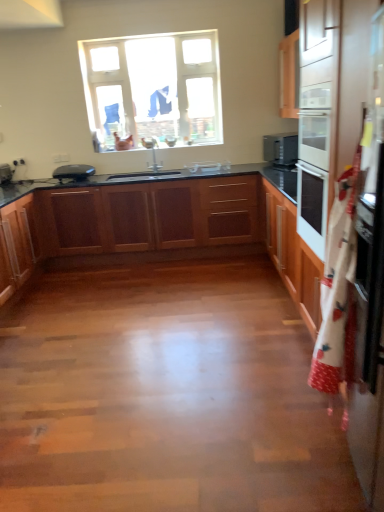
The height and width of the screenshot is (512, 384). Identify the location of wooden cabinets at center, positioned as the 3th cabinetry in back-to-front order. (160, 226).

What do you see at coordinates (18, 244) in the screenshot? The image size is (384, 512). I see `wooden cabinet at left, placed as the second cabinetry when sorted from back to front` at bounding box center [18, 244].

The image size is (384, 512). In order to click on wooden cabinets at center, the 3th cabinetry viewed from the front in this screenshot , I will do `click(150, 216)`.

Where is `wooden floor at center`? wooden floor at center is located at coordinates (166, 395).

From the image's perspective, would you say clear glass window at upper center is shown under matte black toaster at left?

No.

Which point is more forward, (97, 111) or (6, 183)?

The point (6, 183) is in front.

Is clear glass window at upper center bigger than matte black toaster at left?

→ Yes, clear glass window at upper center is bigger than matte black toaster at left.

Is clear glass window at upper center outside of matte black toaster at left?

clear glass window at upper center is positioned outside matte black toaster at left.

From the image's perspective, which one is positioned higher, clear glass window at upper center or white fabric apron at right?

clear glass window at upper center.

Is clear glass window at upper center further to the viewer compared to white fabric apron at right?

Yes, it is behind white fabric apron at right.

Is point (126, 130) positioned behind point (381, 475)?

Yes, it is.

Is wooden floor at center placed right next to clear glass window at upper center?

No, wooden floor at center is not beside clear glass window at upper center.

Who is shorter, wooden floor at center or clear glass window at upper center?

With less height is wooden floor at center.

Is wooden floor at center oriented towards clear glass window at upper center?

No, wooden floor at center is not facing towards clear glass window at upper center.

Is point (367, 356) positioned behind point (7, 206)?

No.

Does white fabric apron at right have a smaller size compared to wooden cabinet at left, placed as the second cabinetry when sorted from back to front?

Indeed, white fabric apron at right has a smaller size compared to wooden cabinet at left, placed as the second cabinetry when sorted from back to front.

Can you tell me how much white fabric apron at right and wooden cabinet at left, which is counted as the second cabinetry, starting from the front, differ in facing direction?

There is a 179-degree angle between the facing directions of white fabric apron at right and wooden cabinet at left, which is counted as the second cabinetry, starting from the front.

Does matte black toaster at left turn towards clear glass window at upper center?

No, matte black toaster at left is not aimed at clear glass window at upper center.

Which of these two, matte black toaster at left or clear glass window at upper center, stands taller?

Standing taller between the two is clear glass window at upper center.

From the image's perspective, which one is positioned lower, matte black toaster at left or clear glass window at upper center?

matte black toaster at left.

Is matte black toaster at left not inside clear glass window at upper center?

That's correct, matte black toaster at left is outside of clear glass window at upper center.

Which of these two, wooden cabinets at center, which is counted as the first cabinetry, starting from the front, or wooden floor at center, is bigger?

wooden cabinets at center, which is counted as the first cabinetry, starting from the front, is bigger.

Is wooden floor at center a part of wooden cabinets at center, which is counted as the first cabinetry, starting from the front?

Yes, wooden floor at center is surrounded by wooden cabinets at center, which is counted as the first cabinetry, starting from the front.

I want to click on the 3rd cabinetry located above the wooden floor at center (from a real-world perspective), so click(160, 226).

Identify the location of home appliance above the matte black toaster at left (from the image's perspective). (281, 150).

From the image's perspective, is matte black toaster at left beneath satin black microwave at upper right?

Yes, from the image's perspective, matte black toaster at left is beneath satin black microwave at upper right.

What's the angular difference between matte black toaster at left and satin black microwave at upper right's facing directions?

The facing directions of matte black toaster at left and satin black microwave at upper right are 167 degrees apart.

Is matte black toaster at left aimed at satin black microwave at upper right?

Yes.

In the image, there is a clear glass window at upper center. Where is `appliance below it (from the image's perspective)`? appliance below it (from the image's perspective) is located at coordinates (5, 174).

In order to click on window that appears behind the white fabric apron at right in this screenshot , I will do `click(153, 89)`.

Based on their spatial positions, is clear glass window at upper center or wooden cabinets at center, marked as the first cabinetry in a back-to-front arrangement, closer to white fabric apron at right?

wooden cabinets at center, marked as the first cabinetry in a back-to-front arrangement, is positioned closer to the anchor white fabric apron at right.

From the image, which object appears to be nearer to wooden cabinets at center, the 3th cabinetry viewed from the front, white fabric apron at right or wooden floor at center?

wooden floor at center.

From the image, which object appears to be farther from wooden cabinets at center, positioned as the 3th cabinetry in back-to-front order, white fabric apron at right or wooden floor at center?

The object further to wooden cabinets at center, positioned as the 3th cabinetry in back-to-front order, is white fabric apron at right.

From the image, which object appears to be nearer to satin black microwave at upper right, wooden floor at center or clear glass window at upper center?

clear glass window at upper center is closer to satin black microwave at upper right.

Which object lies nearer to the anchor point satin black microwave at upper right, wooden cabinet at left, which is counted as the second cabinetry, starting from the front, or clear glass window at upper center?

clear glass window at upper center.

Considering their positions, is wooden cabinets at center, marked as the first cabinetry in a back-to-front arrangement, positioned further to clear glass window at upper center than wooden floor at center?

The object further to clear glass window at upper center is wooden floor at center.

When comparing their distances from wooden cabinets at center, marked as the first cabinetry in a back-to-front arrangement, does satin black microwave at upper right or white fabric apron at right seem closer?

satin black microwave at upper right is closer to wooden cabinets at center, marked as the first cabinetry in a back-to-front arrangement.

Consider the image. Considering their positions, is wooden cabinets at center, marked as the first cabinetry in a back-to-front arrangement, positioned further to wooden cabinets at center, positioned as the 3th cabinetry in back-to-front order, than white fabric apron at right?

Among the two, white fabric apron at right is located further to wooden cabinets at center, positioned as the 3th cabinetry in back-to-front order.

Locate an element on the screen. This screenshot has width=384, height=512. plain between white fabric apron at right and clear glass window at upper center along the z-axis is located at coordinates (166, 395).

The width and height of the screenshot is (384, 512). Identify the location of window between matte black toaster at left and satin black microwave at upper right in the horizontal direction. (153, 89).

What are the coordinates of `appliance located between wooden floor at center and clear glass window at upper center in the depth direction` in the screenshot? It's located at (5, 174).

Where is `home appliance between wooden floor at center and matte black toaster at left in the front-back direction`? home appliance between wooden floor at center and matte black toaster at left in the front-back direction is located at coordinates (281, 150).